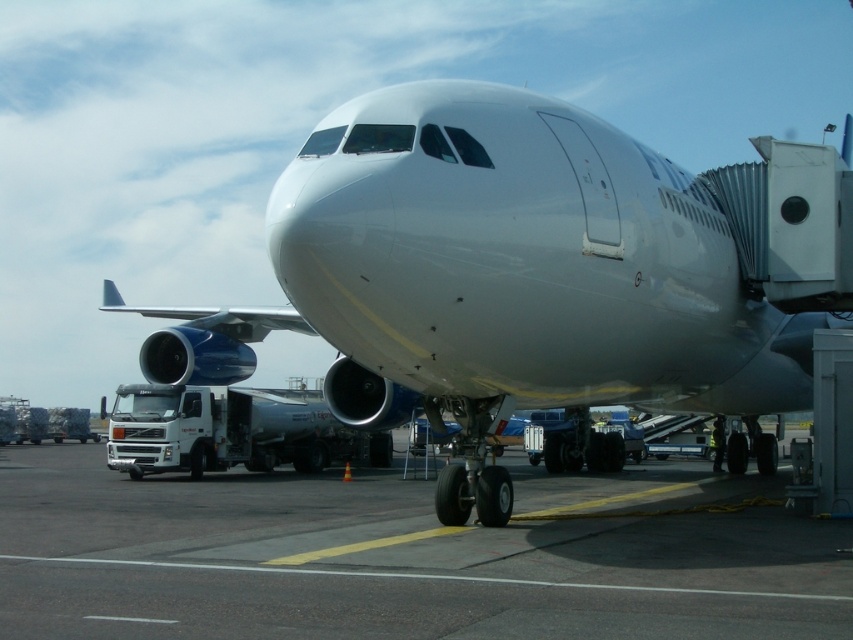
Does point (405, 208) lie in front of point (132, 513)?

Yes, point (405, 208) is in front of point (132, 513).

In the scene shown: Can you confirm if white glossy airplane at center is positioned to the right of smooth asphalt tarmac at center?

Correct, you'll find white glossy airplane at center to the right of smooth asphalt tarmac at center.

Locate an element on the screen. The image size is (853, 640). white glossy airplane at center is located at coordinates (543, 272).

The height and width of the screenshot is (640, 853). Identify the location of white glossy airplane at center. (543, 272).